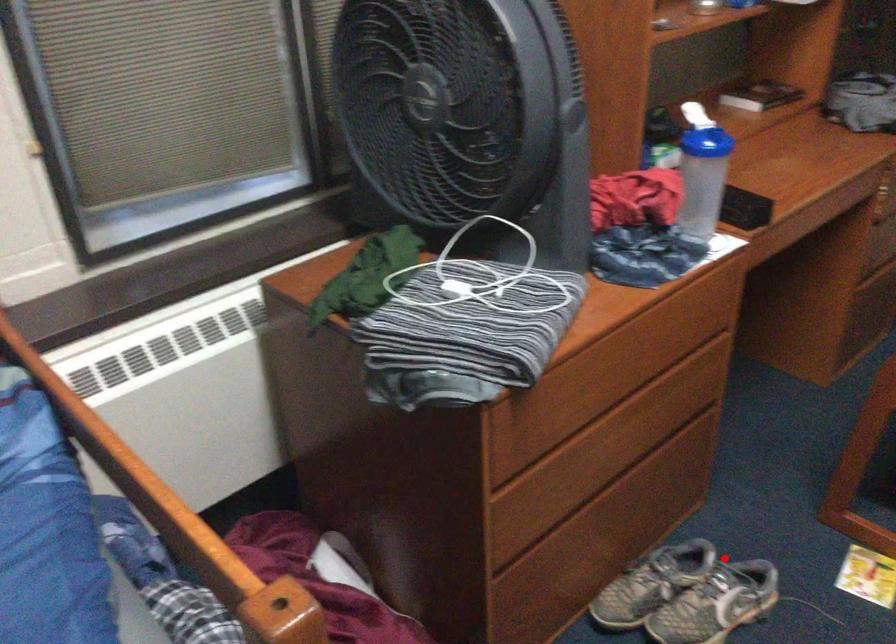
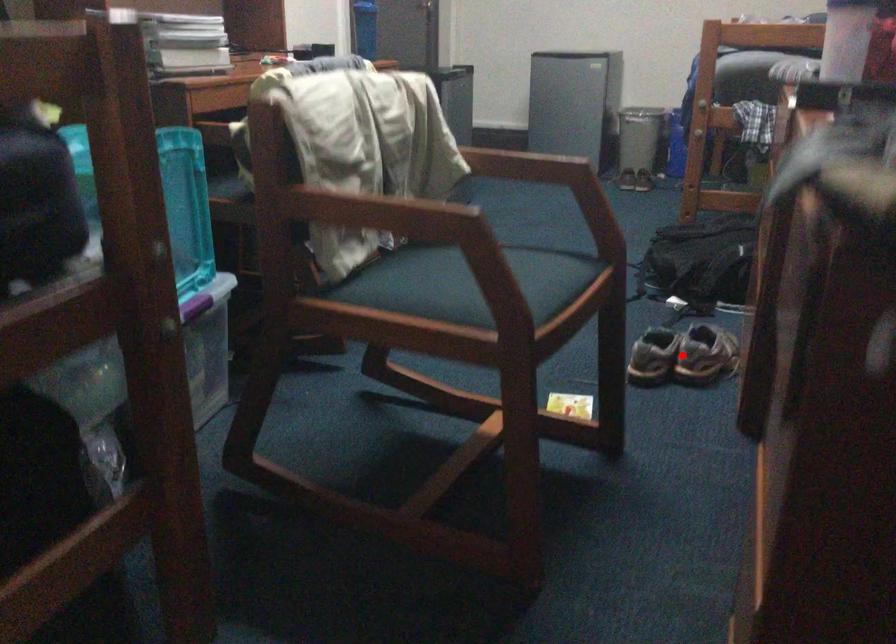
I am providing you with two images of the same scene from different viewpoints. A red point is marked on the first image and another point is marked on the second image. Are the points marked in image1 and image2 representing the same 3D position?

Yes